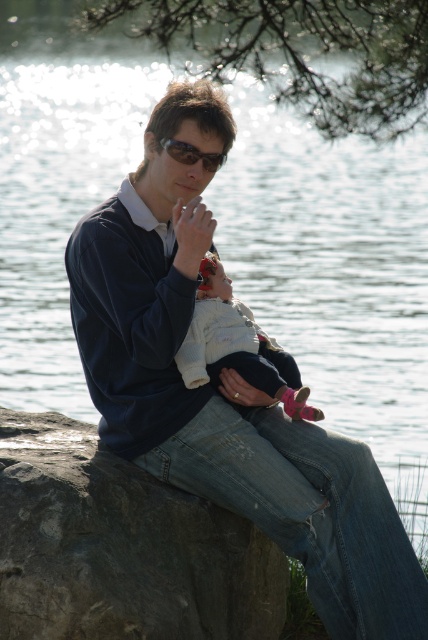
Question: Among these points, which one is farthest from the camera?

Choices:
 (A) click(x=190, y=160)
 (B) click(x=187, y=508)

Answer: (A)

Question: Considering the real-world distances, which object is farthest from the sunglasses at center?

Choices:
 (A) white soft baby at center
 (B) dark blue denim jacket at center
 (C) rough gray rock at lower left

Answer: (C)

Question: Does dark blue denim jacket at center have a greater width compared to sunglasses at center?

Choices:
 (A) no
 (B) yes

Answer: (B)

Question: Which object is closer to the camera taking this photo?

Choices:
 (A) sunglasses at center
 (B) rough gray rock at lower left
 (C) white soft baby at center

Answer: (B)

Question: Is rough gray rock at lower left to the left of sunglasses at center from the viewer's perspective?

Choices:
 (A) yes
 (B) no

Answer: (A)

Question: Does dark blue denim jacket at center appear under white soft baby at center?

Choices:
 (A) yes
 (B) no

Answer: (A)